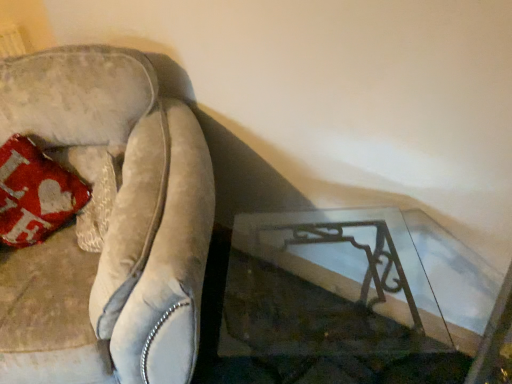
What is the approximate height of velvet couch at left?

It is 37.78 inches.

The height and width of the screenshot is (384, 512). I want to click on velvet couch at left, so click(108, 225).

What is the approximate width of velvet couch at left?

36.67 inches.

The width and height of the screenshot is (512, 384). What do you see at coordinates (108, 225) in the screenshot?
I see `velvet couch at left` at bounding box center [108, 225].

Identify the location of clear glass table at lower right. This screenshot has height=384, width=512. (343, 299).

Image resolution: width=512 pixels, height=384 pixels. What do you see at coordinates (343, 299) in the screenshot?
I see `clear glass table at lower right` at bounding box center [343, 299].

Where is `velvet couch at left`? This screenshot has width=512, height=384. velvet couch at left is located at coordinates (108, 225).

From the picture: Visually, is velvet couch at left positioned to the left or to the right of clear glass table at lower right?

From the image, it's evident that velvet couch at left is to the left of clear glass table at lower right.

Looking at this image, is velvet couch at left in front of clear glass table at lower right?

That is False.

Is point (117, 346) behind point (411, 289)?

No, it is in front of (411, 289).

From the image's perspective, is velvet couch at left over clear glass table at lower right?

Yes.

From a real-world perspective, between velvet couch at left and clear glass table at lower right, who is vertically lower?

clear glass table at lower right is physically lower.

Considering the sizes of objects velvet couch at left and clear glass table at lower right in the image provided, who is wider, velvet couch at left or clear glass table at lower right?

velvet couch at left is wider.

Based on the photo, between velvet couch at left and clear glass table at lower right, which one has less height?

clear glass table at lower right.

Considering the sizes of objects velvet couch at left and clear glass table at lower right in the image provided, who is bigger, velvet couch at left or clear glass table at lower right?

velvet couch at left is bigger.

Which is correct: velvet couch at left is inside clear glass table at lower right, or outside of it?

The correct answer is: outside.

Would you consider velvet couch at left to be distant from clear glass table at lower right?

That's not correct — velvet couch at left is a little close to clear glass table at lower right.

Consider the image. Does velvet couch at left turn towards clear glass table at lower right?

No, velvet couch at left is not oriented towards clear glass table at lower right.

How different are the orientations of velvet couch at left and clear glass table at lower right in degrees?

The angle between the facing direction of velvet couch at left and the facing direction of clear glass table at lower right is 10 degrees.

This screenshot has height=384, width=512. I want to click on furniture above the clear glass table at lower right (from the image's perspective), so click(x=108, y=225).

Between clear glass table at lower right and velvet couch at left, which one appears on the right side from the viewer's perspective?

Positioned to the right is clear glass table at lower right.

Is clear glass table at lower right in front of or behind velvet couch at left in the image?

Clearly, clear glass table at lower right is in front of velvet couch at left.

Is point (362, 381) in front of point (160, 314)?

That is False.

From the image's perspective, which object appears higher, clear glass table at lower right or velvet couch at left?

velvet couch at left appears higher in the image.

From a real-world perspective, between clear glass table at lower right and velvet couch at left, who is vertically higher?

From a 3D spatial view, velvet couch at left is above.

Does clear glass table at lower right have a greater width compared to velvet couch at left?

Incorrect, the width of clear glass table at lower right does not surpass that of velvet couch at left.

Considering the relative sizes of clear glass table at lower right and velvet couch at left in the image provided, is clear glass table at lower right taller than velvet couch at left?

No.

In the scene shown: Considering the relative sizes of clear glass table at lower right and velvet couch at left in the image provided, is clear glass table at lower right smaller than velvet couch at left?

Correct, clear glass table at lower right occupies less space than velvet couch at left.

Is velvet couch at left surrounded by clear glass table at lower right?

Actually, velvet couch at left is outside clear glass table at lower right.

Are clear glass table at lower right and velvet couch at left making contact?

No, clear glass table at lower right is not in contact with velvet couch at left.

Is clear glass table at lower right facing away from velvet couch at left?

clear glass table at lower right is not turned away from velvet couch at left.

How many degrees apart are the facing directions of clear glass table at lower right and velvet couch at left?

The angular difference between clear glass table at lower right and velvet couch at left is 10 degrees.

Where is `furniture that is behind the clear glass table at lower right`? The height and width of the screenshot is (384, 512). furniture that is behind the clear glass table at lower right is located at coordinates (108, 225).

Identify the location of table that appears in front of the velvet couch at left. (x=343, y=299).

Locate an element on the screen. furniture above the clear glass table at lower right (from the image's perspective) is located at coordinates (108, 225).